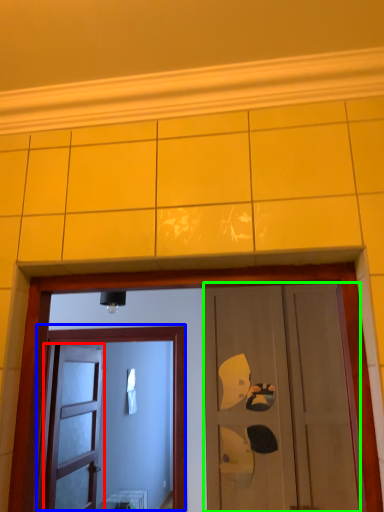
Question: Based on their relative distances, which object is farther from door (highlighted by a red box)? Choose from door (highlighted by a blue box) and door (highlighted by a green box).

Choices:
 (A) door
 (B) door

Answer: (B)